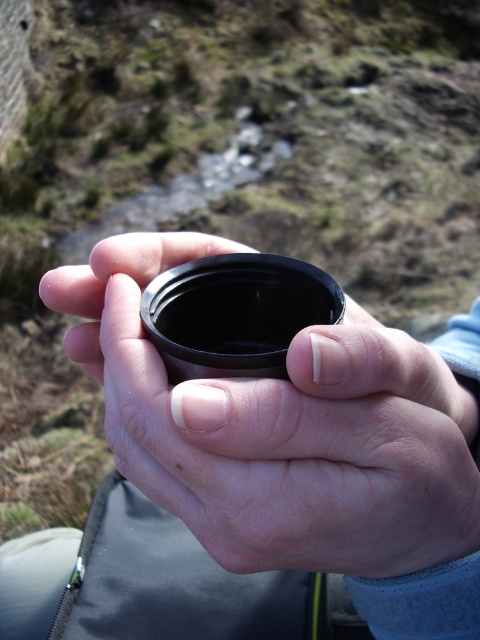
Question: Can you confirm if black matte cup at center is smaller than black matte lens at center?

Choices:
 (A) no
 (B) yes

Answer: (A)

Question: Which object appears farthest from the camera in this image?

Choices:
 (A) black matte cup at center
 (B) black matte lens at center

Answer: (B)

Question: Which point is closer to the camera?

Choices:
 (A) black matte cup at center
 (B) black matte lens at center

Answer: (A)

Question: Does black matte cup at center have a smaller size compared to black matte lens at center?

Choices:
 (A) yes
 (B) no

Answer: (B)

Question: Which of the following is the farthest from the observer?

Choices:
 (A) black matte cup at center
 (B) black matte lens at center

Answer: (B)

Question: Does black matte cup at center appear on the right side of black matte lens at center?

Choices:
 (A) yes
 (B) no

Answer: (A)